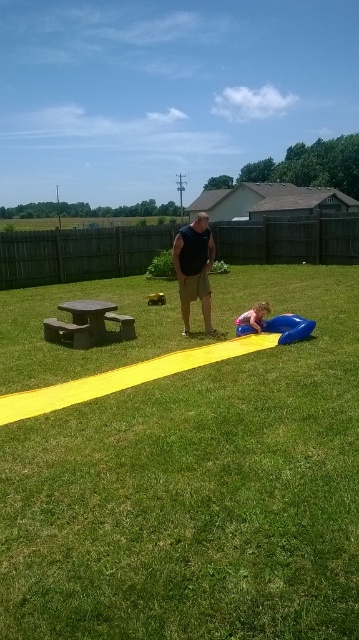
Does green grass at center have a lesser height compared to blue rubber pool at lower center?

No, green grass at center is not shorter than blue rubber pool at lower center.

Is point (72, 464) positioned behind point (241, 336)?

No, it is not.

The image size is (359, 640). I want to click on green grass at center, so click(198, 490).

Identify the location of green grass at center. This screenshot has height=640, width=359. (198, 490).

What do you see at coordinates (193, 268) in the screenshot? I see `matte black tank top at center` at bounding box center [193, 268].

Does matte black tank top at center appear over smooth pink ball at lower center?

Indeed, matte black tank top at center is positioned over smooth pink ball at lower center.

What do you see at coordinates (193, 268) in the screenshot? I see `matte black tank top at center` at bounding box center [193, 268].

This screenshot has height=640, width=359. Identify the location of matte black tank top at center. (193, 268).

Between green grass at center and matte black tank top at center, which one is positioned higher?

matte black tank top at center is above.

Is green grass at center further to the viewer compared to matte black tank top at center?

That is False.

Who is more distant from viewer, (318, 573) or (204, 237)?

Positioned behind is point (204, 237).

Locate an element on the screen. green grass at center is located at coordinates click(x=198, y=490).